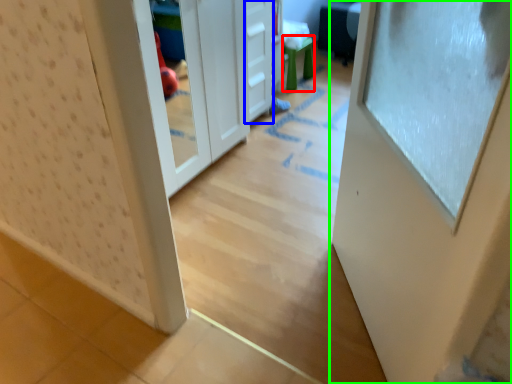
Question: Which object is the closest to the stool (highlighted by a red box)? Choose among these: drawer (highlighted by a blue box) or door (highlighted by a green box).

Choices:
 (A) drawer
 (B) door

Answer: (A)